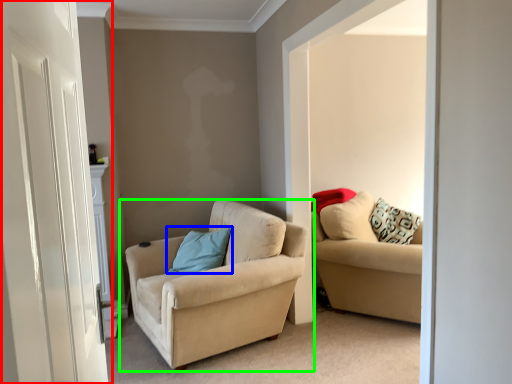
Question: Which is farther away from door (highlighted by a red box)? pillow (highlighted by a blue box) or studio couch (highlighted by a green box)?

Choices:
 (A) pillow
 (B) studio couch

Answer: (A)